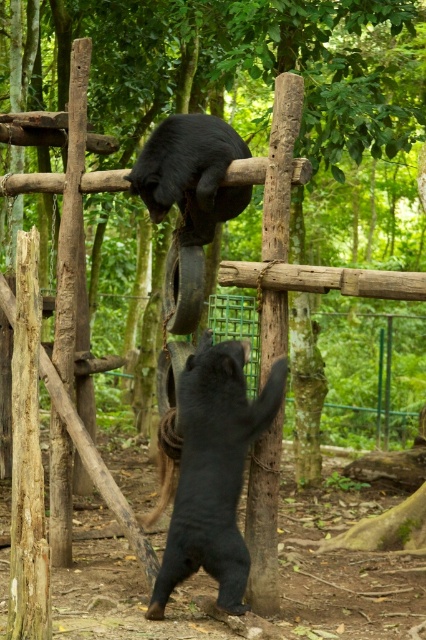
Consider the image. You are a wildlife photographer aiming to capture the shiny black bear at center in your shot. Based on its position, which direction should you adjust your camera to focus on it?

The shiny black bear at center is located at point coordinates, so you should adjust your camera towards the center of the image to focus on it.

You are a zookeeper observing the bears in their enclosure. You need to determine if the black matte bear at upper center is currently on top of the brown wood pole at center. Based on the scene description, can you confirm this?

The brown wood pole at center is positioned under the black matte bear at upper center, which means the black matte bear at upper center is indeed on top of the brown wood pole at center.

From the picture: You are a wildlife photographer aiming to capture a closeup shot of the shiny black bear at center. However, the brown wood pole at center is blocking your view. Can you estimate whether the pole is wider than the bear to determine if moving closer would help?

The shiny black bear at center might be wider than brown wood pole at center, so there is a possibility that moving closer could reduce the obstruction caused by the pole, as the bear may appear larger relative to the pole from a nearer vantage point.